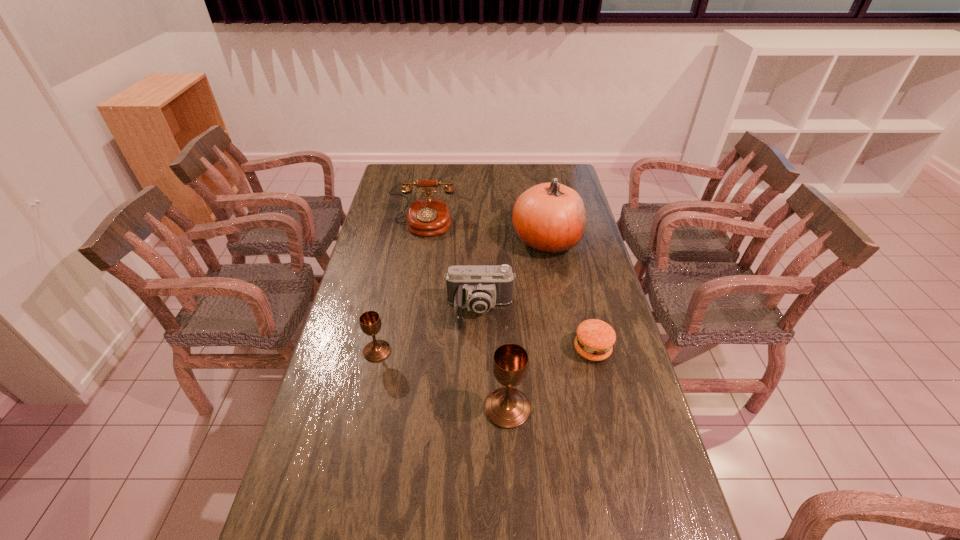
Find the location of `the third closest object to the shorter chalice`. the third closest object to the shorter chalice is located at coordinates (429, 216).

Find the location of a particular element. the closest object to the telephone is located at coordinates (550, 218).

The image size is (960, 540). In order to click on vacant area in the image that satisfies the following two spatial constraints: 1. at the front of the fourth nearest object with an open lens cover; 2. on the right side of the taller chalice in this screenshot , I will do `click(480, 408)`.

Identify the location of free space that satisfies the following two spatial constraints: 1. on the front side of the patty; 2. on the left side of the tallest object. (566, 349).

Locate an element on the screen. The image size is (960, 540). free space that satisfies the following two spatial constraints: 1. on the dial of the shortest object; 2. on the right side of the telephone is located at coordinates (402, 349).

At what (x,y) coordinates should I click in order to perform the action: click on free region that satisfies the following two spatial constraints: 1. on the dial of the telephone; 2. on the left side of the nearer chalice. Please return your answer as a coordinate pair (x, y). Image resolution: width=960 pixels, height=540 pixels. Looking at the image, I should click on pyautogui.click(x=393, y=408).

You are a GUI agent. You are given a task and a screenshot of the screen. Output one action in this format:
    pyautogui.click(x=<x>, y=<y>)
    Task: Click on the blank area in the image that satisfies the following two spatial constraints: 1. on the dial of the telephone; 2. on the right side of the taller chalice
    
    Given the screenshot: What is the action you would take?
    pyautogui.click(x=393, y=408)